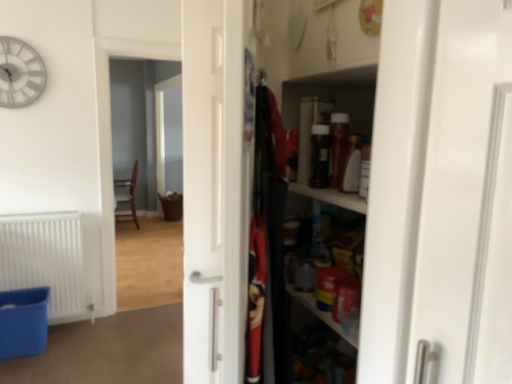
Question: From their relative heights in the image, would you say blue plastic laundry basket at lower left is taller or shorter than wooden chair at left?

Choices:
 (A) tall
 (B) short

Answer: (B)

Question: Based on their positions, is blue plastic laundry basket at lower left located to the left or right of wooden chair at left?

Choices:
 (A) left
 (B) right

Answer: (B)

Question: Which is nearer to the wooden chair at left?

Choices:
 (A) metallic clock at upper left
 (B) wooden chair at center
 (C) brown woven basket at center
 (D) blue plastic laundry basket at lower left
 (E) white matte radiator at lower left

Answer: (B)

Question: Based on their relative distances, which object is farther from the brown woven basket at center?

Choices:
 (A) wooden chair at center
 (B) blue plastic laundry basket at lower left
 (C) white matte radiator at lower left
 (D) metallic clock at upper left
 (E) wooden chair at left

Answer: (B)